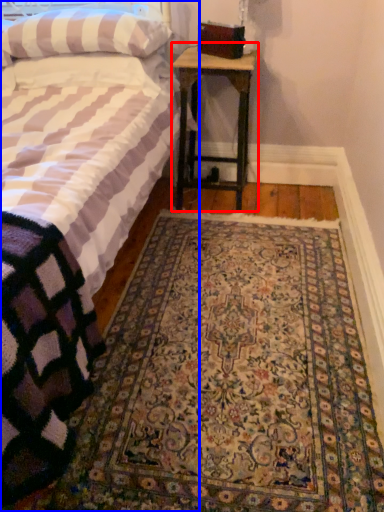
Question: Which of the following is the closest to the observer, nightstand (highlighted by a red box) or bed (highlighted by a blue box)?

Choices:
 (A) nightstand
 (B) bed

Answer: (B)